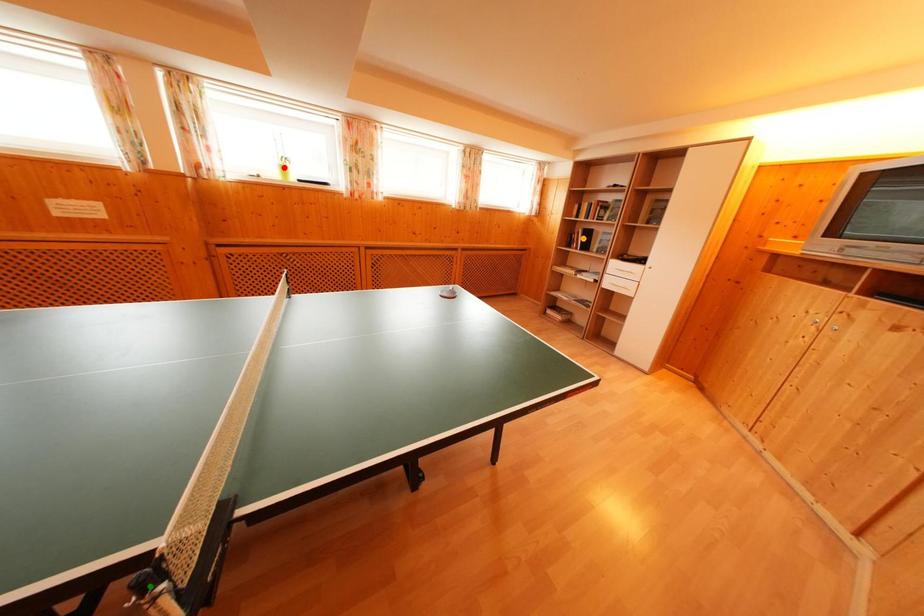
Order these from nearest to farthest:
orange point | red point | green point

green point → red point → orange point